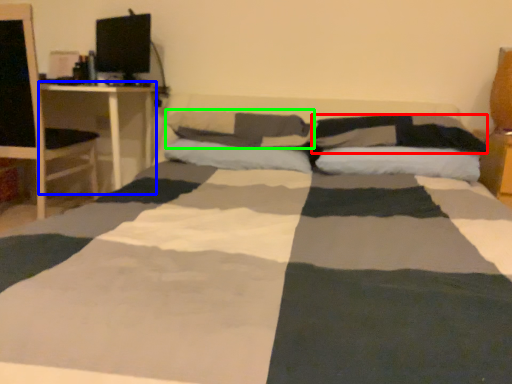
Question: Which object is the closest to the pillow (highlighted by a red box)? Choose among these: desk (highlighted by a blue box) or pillow (highlighted by a green box).

Choices:
 (A) desk
 (B) pillow

Answer: (B)